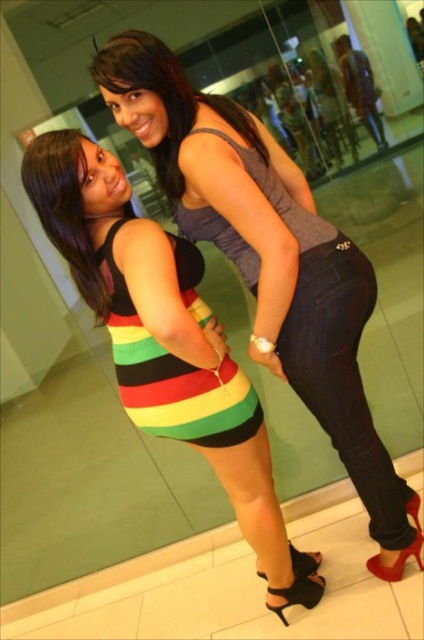
Is multicolored striped tank top at center above striped fabric dress at lower left?

No, multicolored striped tank top at center is not above striped fabric dress at lower left.

Which is more to the right, multicolored striped tank top at center or striped fabric dress at lower left?

Positioned to the right is multicolored striped tank top at center.

The image size is (424, 640). What are the coordinates of `multicolored striped tank top at center` in the screenshot? It's located at (173, 378).

In order to click on multicolored striped tank top at center in this screenshot , I will do `click(173, 378)`.

Consider the image. Who is positioned more to the left, jeans at center or multicolored striped tank top at center?

Positioned to the left is multicolored striped tank top at center.

Does point (292, 385) come closer to viewer compared to point (137, 339)?

No, it is not.

Find the location of `jeans at center`. jeans at center is located at coordinates (343, 376).

Can you confirm if striped fabric dress at center is bigger than jeans at center?

Yes, striped fabric dress at center is bigger than jeans at center.

Is striped fabric dress at center taller than jeans at center?

Yes, striped fabric dress at center is taller than jeans at center.

Which is behind, point (203, 118) or point (323, 275)?

The point (203, 118) is more distant.

The image size is (424, 640). Find the location of `striped fabric dress at center`. striped fabric dress at center is located at coordinates (268, 260).